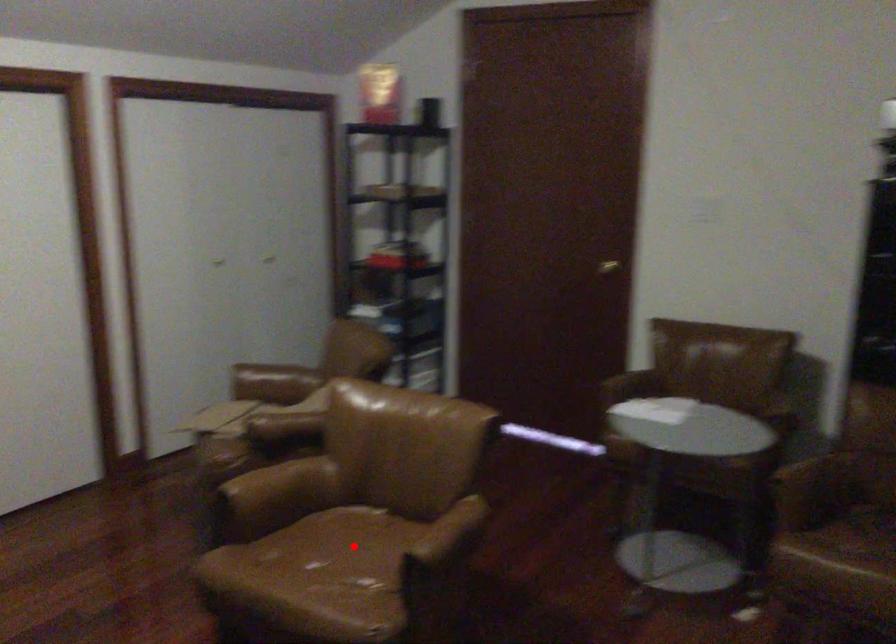
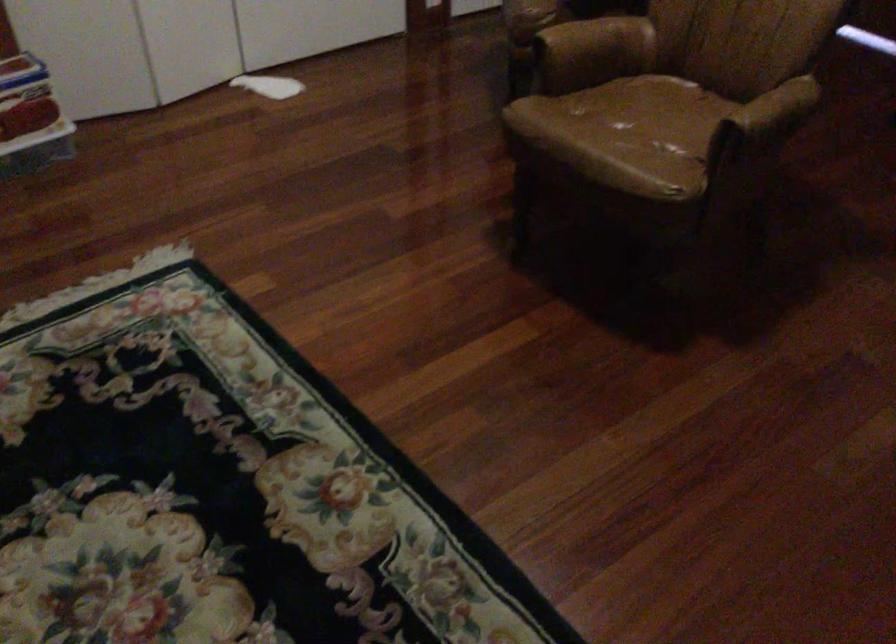
In the second image, find the point that corresponds to the highlighted location in the first image.

(661, 109)